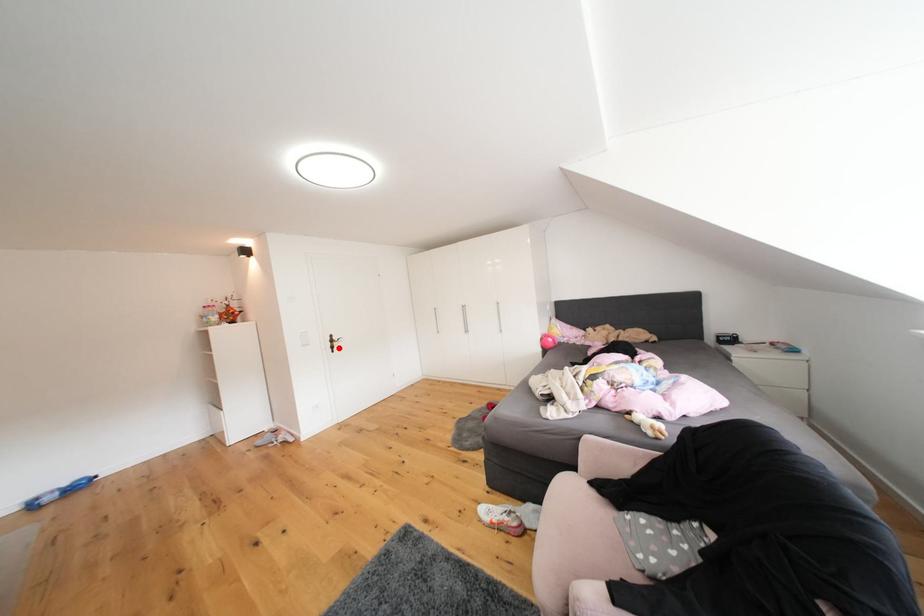
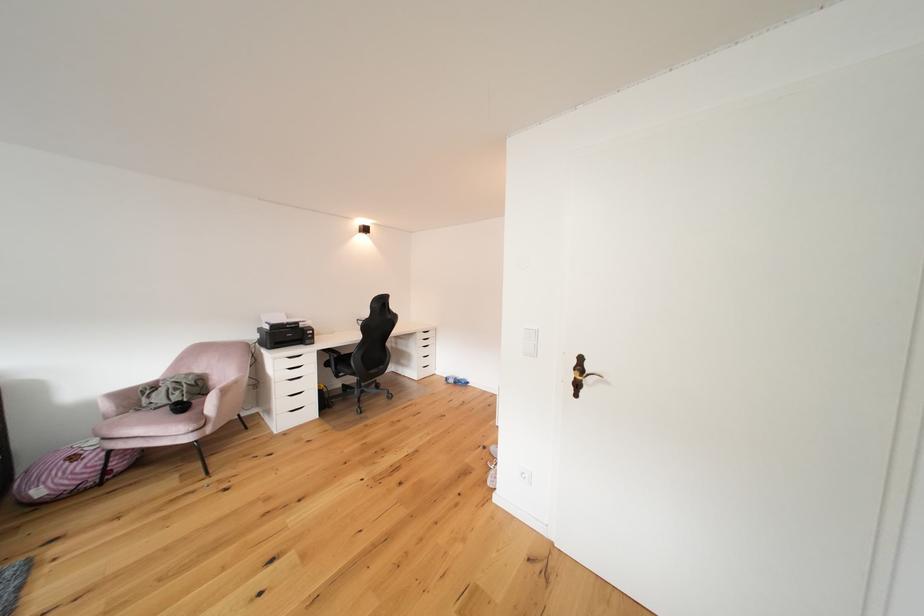
Locate, in the second image, the point that corresponds to the highlighted location in the first image.

(580, 379)